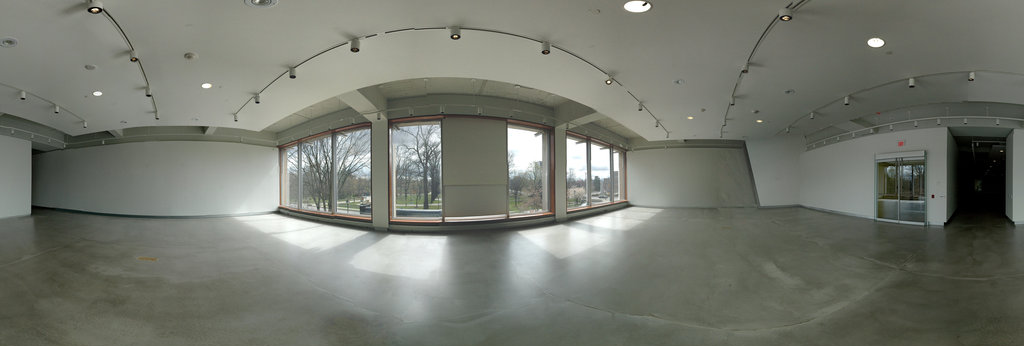
The image size is (1024, 346). What are the coordinates of `floor` in the screenshot? It's located at point(424,287).